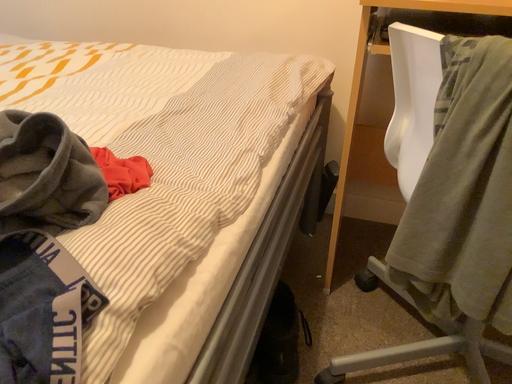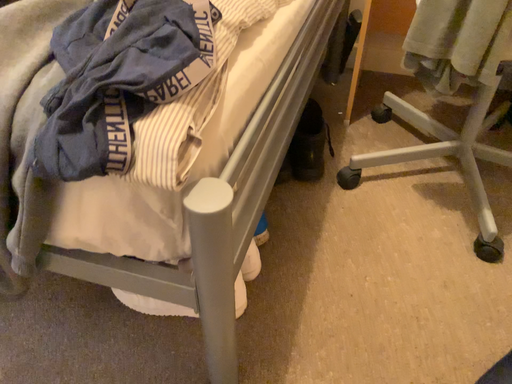
Question: Which way did the camera rotate in the video?

Choices:
 (A) rotated downward
 (B) rotated upward

Answer: (A)